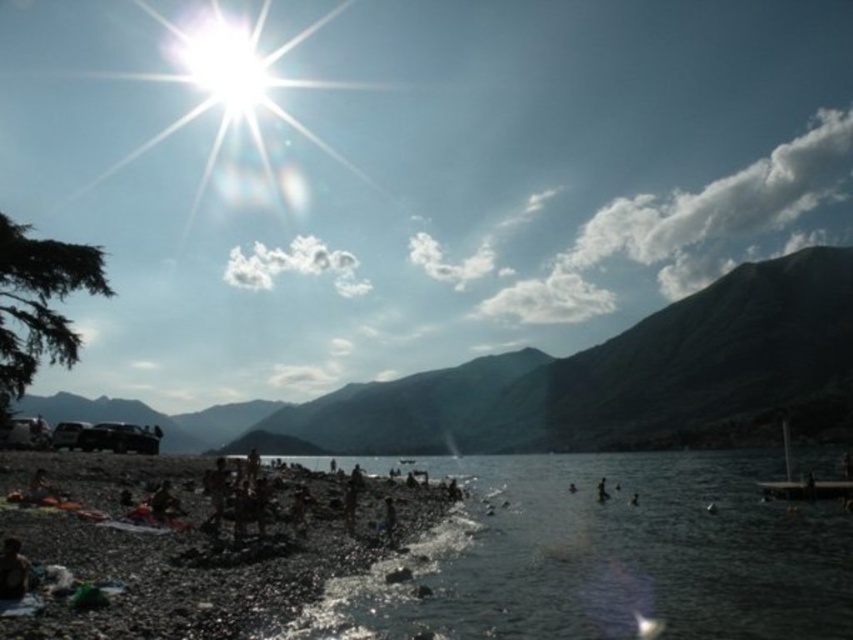
Question: Can you confirm if dark brown pebbles at lower left is bigger than smooth skin person at lower right?

Choices:
 (A) no
 (B) yes

Answer: (B)

Question: Considering the real-world distances, which object is farthest from the dark brown pebbles at lower left?

Choices:
 (A) brown textured towel at lower left
 (B) green matte mountain at upper center

Answer: (B)

Question: Can you confirm if green matte mountain at upper center is positioned to the right of smooth skin person at lower right?

Choices:
 (A) no
 (B) yes

Answer: (A)

Question: Does clear water at lower center appear over green matte mountain at upper center?

Choices:
 (A) yes
 (B) no

Answer: (A)

Question: Among these objects, which one is farthest from the camera?

Choices:
 (A) dark brown pebbles at lower left
 (B) clear water at lower center

Answer: (B)

Question: Which of the following is the farthest from the observer?

Choices:
 (A) coord(651,336)
 (B) coord(289,500)
 (C) coord(599,497)

Answer: (A)